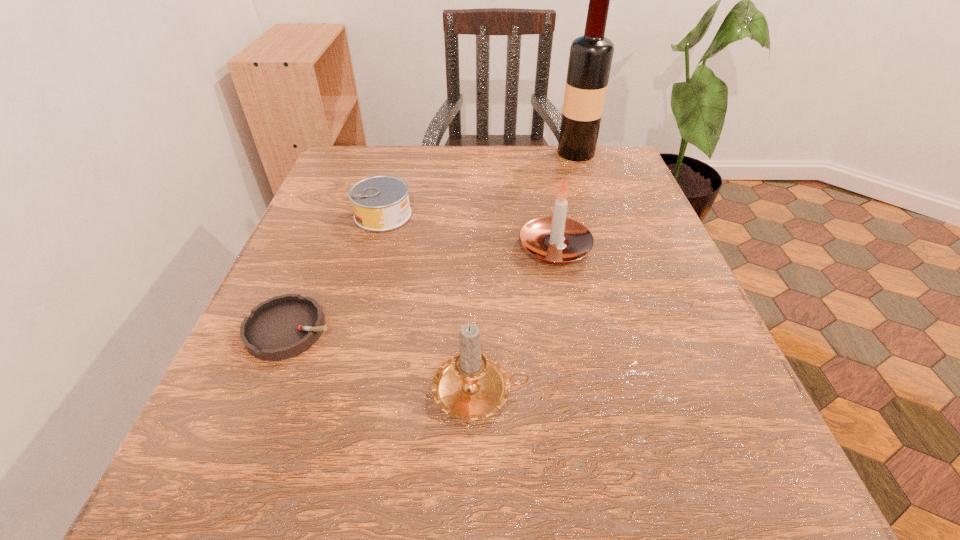
The image size is (960, 540). I want to click on free space located on the right of the fourth tallest object, so coord(581,215).

Identify the location of vacant area situated on the front of the ashtray. (243, 447).

The height and width of the screenshot is (540, 960). Identify the location of object located at the far edge. (590, 59).

You are a GUI agent. You are given a task and a screenshot of the screen. Output one action in this format:
    pyautogui.click(x=<x>, y=<y>)
    Task: Click on the can positioned at the left edge
    This screenshot has width=960, height=540.
    Given the screenshot: What is the action you would take?
    pyautogui.click(x=380, y=203)

Locate an element on the screen. ashtray situated at the left edge is located at coordinates (282, 327).

This screenshot has width=960, height=540. In order to click on wine bottle positioned at the right edge in this screenshot , I will do `click(590, 59)`.

Find the location of `candle located at the right edge`. candle located at the right edge is located at coordinates (555, 239).

I want to click on object that is at the far right corner, so click(590, 59).

Where is `vacant space at the far edge of the desktop`? This screenshot has width=960, height=540. vacant space at the far edge of the desktop is located at coordinates (526, 150).

You are a GUI agent. You are given a task and a screenshot of the screen. Output one action in this format:
    pyautogui.click(x=<x>, y=<y>)
    Task: Click on the free spot at the near edge of the desktop
    The height and width of the screenshot is (540, 960).
    Given the screenshot: What is the action you would take?
    pyautogui.click(x=451, y=456)